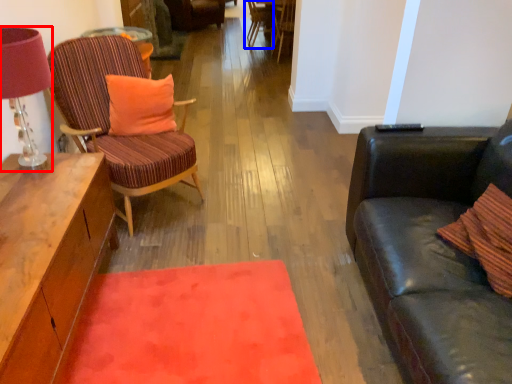
Question: Which point is closer to the camera, lamp (highlighted by a red box) or chair (highlighted by a blue box)?

Choices:
 (A) lamp
 (B) chair

Answer: (A)